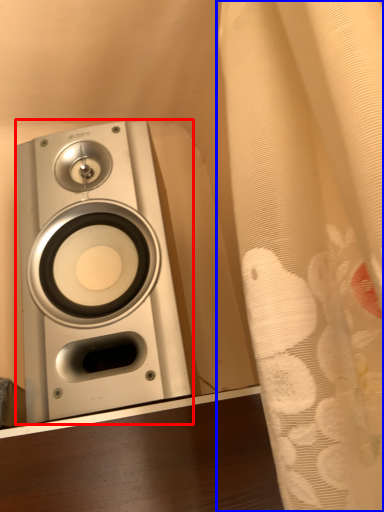
Question: Which of the following is the closest to the observer, home appliance (highlighted by a red box) or curtain (highlighted by a blue box)?

Choices:
 (A) home appliance
 (B) curtain

Answer: (B)